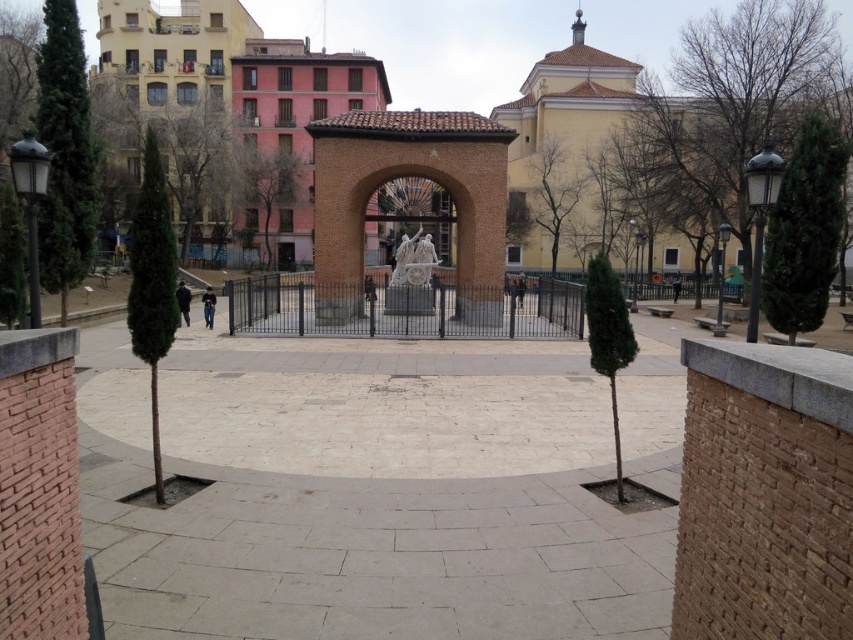
Question: Does brown brick archway at center appear on the left side of brick textured archway at center?

Choices:
 (A) no
 (B) yes

Answer: (B)

Question: Which object is farther from the camera taking this photo?

Choices:
 (A) brick textured archway at center
 (B) brown brick archway at center

Answer: (A)

Question: Is brown brick archway at center positioned in front of brick textured archway at center?

Choices:
 (A) no
 (B) yes

Answer: (B)

Question: Which object appears farthest from the camera in this image?

Choices:
 (A) brown brick archway at center
 (B) brick textured archway at center

Answer: (B)

Question: Can you confirm if brown brick archway at center is positioned to the right of brick textured archway at center?

Choices:
 (A) no
 (B) yes

Answer: (A)